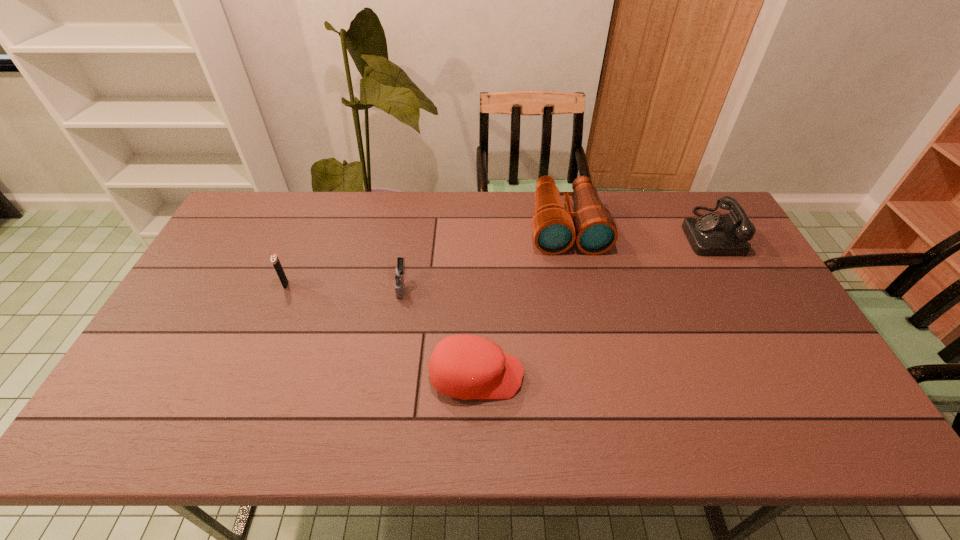
Locate an element on the screen. free space between the telephone and the right igniter is located at coordinates point(556,259).

This screenshot has width=960, height=540. I want to click on blank region between the telephone and the fourth object from left to right, so click(637, 229).

Find the location of a particular element. The height and width of the screenshot is (540, 960). object identified as the closest to the rightmost object is located at coordinates [555, 229].

Choose which object is the third nearest neighbor to the right igniter. Please provide its 2D coordinates. Your answer should be formatted as a tuple, i.e. [(x, y)], where the tuple contains the x and y coordinates of a point satisfying the conditions above.

[(555, 229)]

I want to click on free location that satisfies the following two spatial constraints: 1. through the lenses of the binoculars; 2. on the front-facing side of the cap, so click(598, 376).

At what (x,y) coordinates should I click in order to perform the action: click on free region that satisfies the following two spatial constraints: 1. through the lenses of the binoculars; 2. on the front-facing side of the cap. Please return your answer as a coordinate pair (x, y). Image resolution: width=960 pixels, height=540 pixels. Looking at the image, I should click on (598, 376).